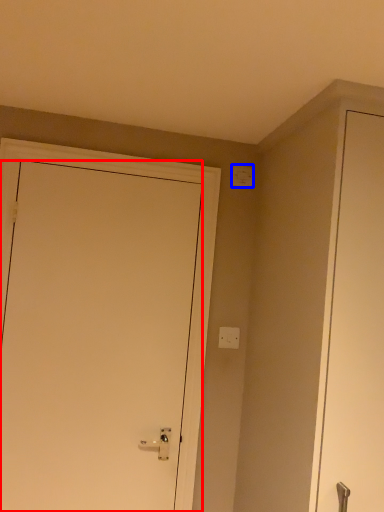
Question: Which point is further to the camera, door (highlighted by a red box) or light switch (highlighted by a blue box)?

Choices:
 (A) door
 (B) light switch

Answer: (B)